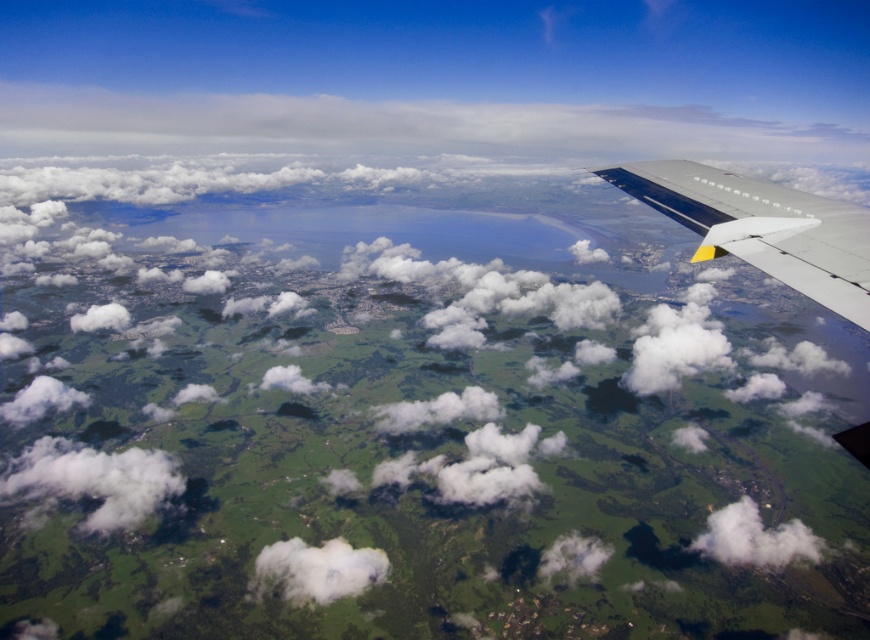
Question: Which point is closer to the camera?

Choices:
 (A) (740, 531)
 (B) (835, 202)
 (C) (298, 547)

Answer: (B)

Question: Which is nearer to the white fluffy cloud at center?

Choices:
 (A) white fluffy cloud at lower left
 (B) white fluffy cloud at lower right

Answer: (A)

Question: Does white matte wing at upper right appear over white fluffy cloud at center?

Choices:
 (A) no
 (B) yes

Answer: (B)

Question: Which of the following is the closest to the observer?

Choices:
 (A) (265, 545)
 (B) (44, 476)

Answer: (A)

Question: Can you confirm if white fluffy cloud at center is bigger than white fluffy cloud at lower right?

Choices:
 (A) yes
 (B) no

Answer: (B)

Question: Does white matte wing at upper right appear under white fluffy cloud at lower left?

Choices:
 (A) no
 (B) yes

Answer: (A)